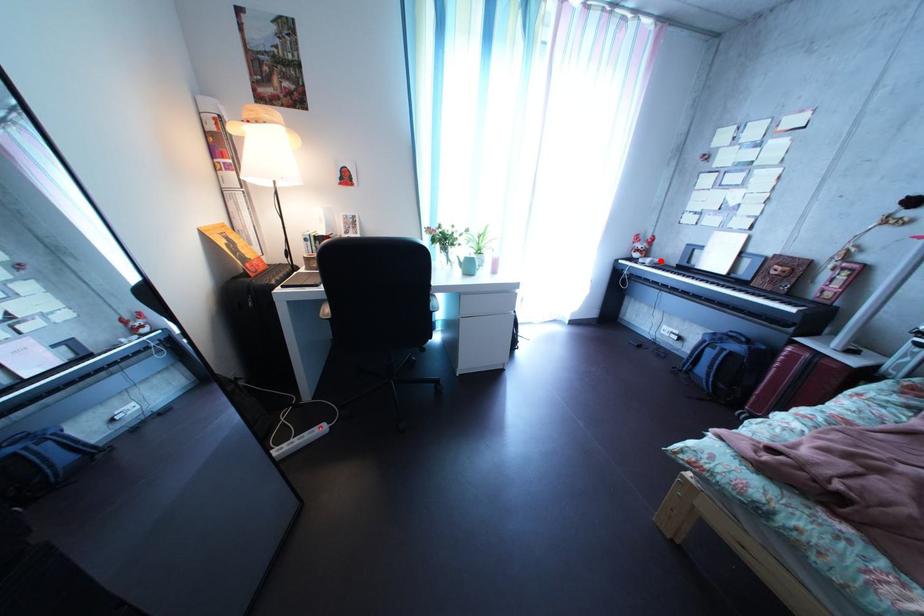
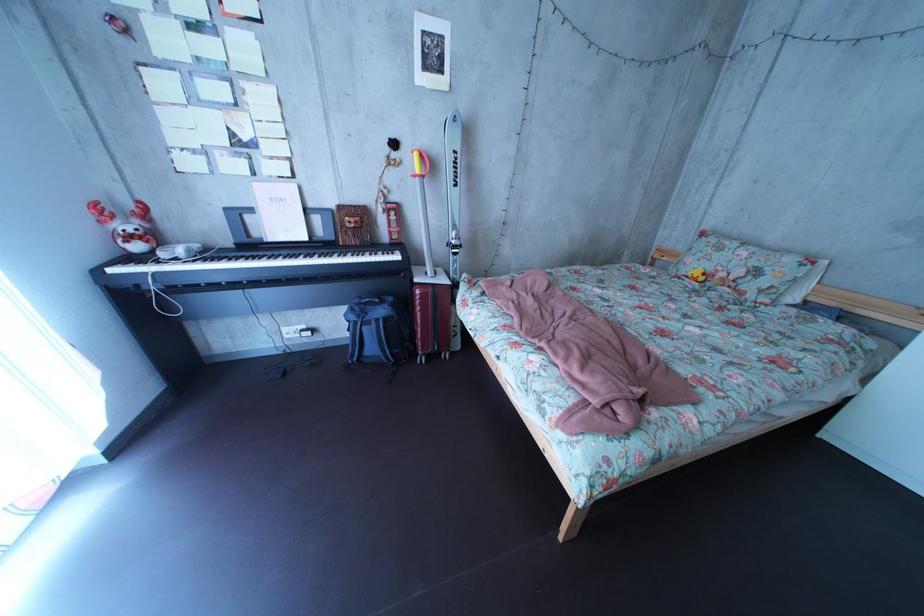
In the second image, find the point that corresponds to the highlighted location in the first image.

(169, 246)